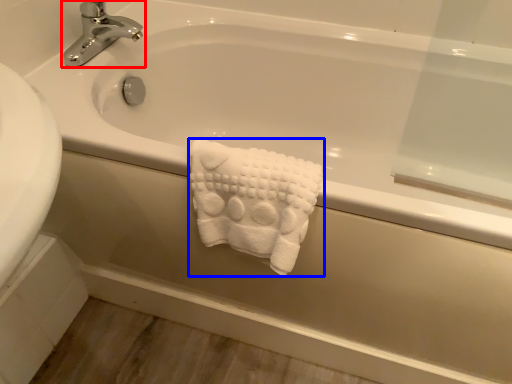
Question: Among these objects, which one is nearest to the camera, tap (highlighted by a red box) or towel (highlighted by a blue box)?

Choices:
 (A) tap
 (B) towel

Answer: (B)